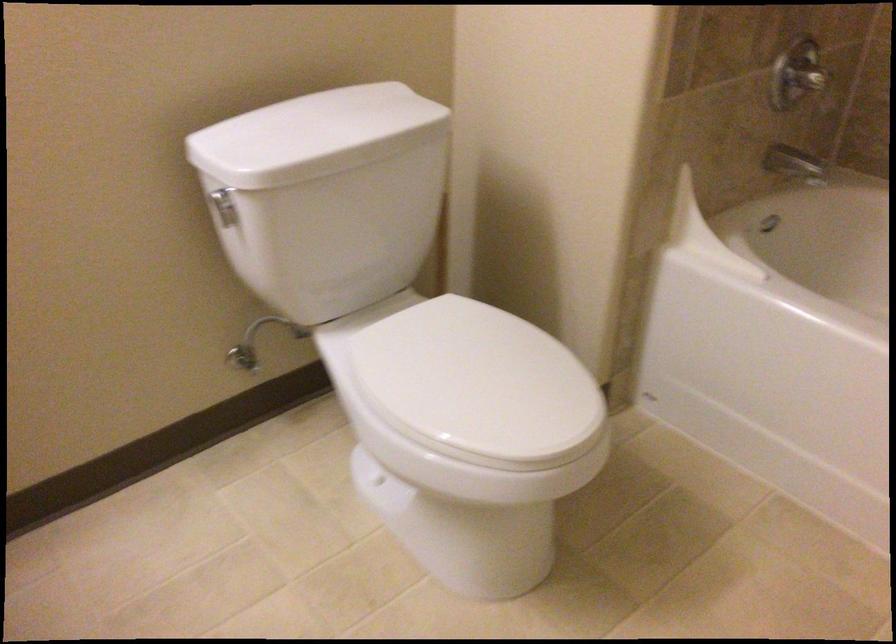
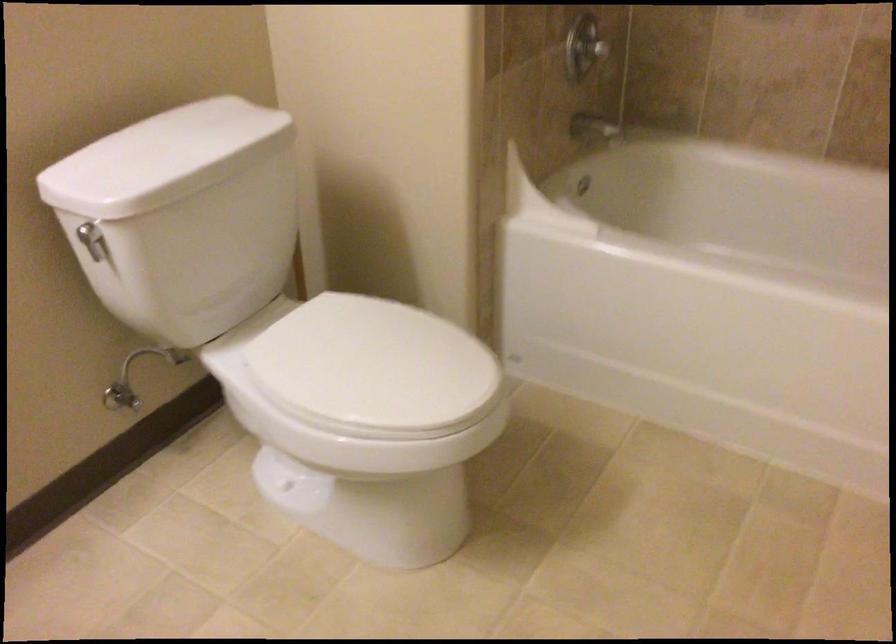
Consider the image. What movement of the cameraman would produce the second image?

The movement direction of the cameraman is left, backward.